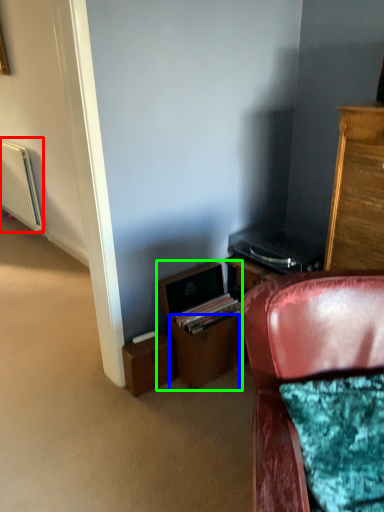
Question: Which object is the closest to the radiator (highlighted by a red box)? Choose among these: drawer (highlighted by a blue box) or file cabinet (highlighted by a green box).

Choices:
 (A) drawer
 (B) file cabinet

Answer: (B)